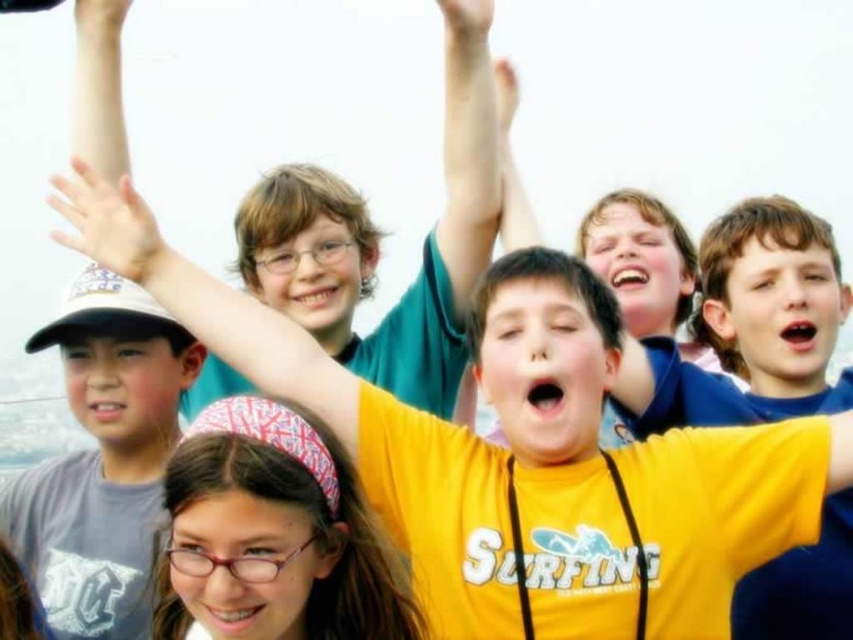
Which of these two, matte skin hand at upper center or matte skin hand at upper left, stands taller?

matte skin hand at upper center

Is matte skin hand at upper center to the right of matte skin hand at upper left from the viewer's perspective?

Indeed, matte skin hand at upper center is positioned on the right side of matte skin hand at upper left.

Between point (468, 22) and point (96, 17), which one is positioned behind?

Point (96, 17)

Where is `matte skin hand at upper center`? matte skin hand at upper center is located at coordinates (467, 16).

Does white matte hand at upper left lie in front of matte skin hand at upper center?

Yes.

Is point (134, 216) farther from camera compared to point (479, 35)?

That is False.

What are the coordinates of `white matte hand at upper left` in the screenshot? It's located at (109, 225).

In the scene shown: Is matte skin hand at upper center above white matte hand at upper center?

Yes, matte skin hand at upper center is above white matte hand at upper center.

Is point (462, 6) positioned before point (494, 65)?

Yes, it is.

Who is more distant from viewer, (491, 3) or (506, 120)?

The point (506, 120) is behind.

The width and height of the screenshot is (853, 640). In order to click on matte skin hand at upper center in this screenshot , I will do 467,16.